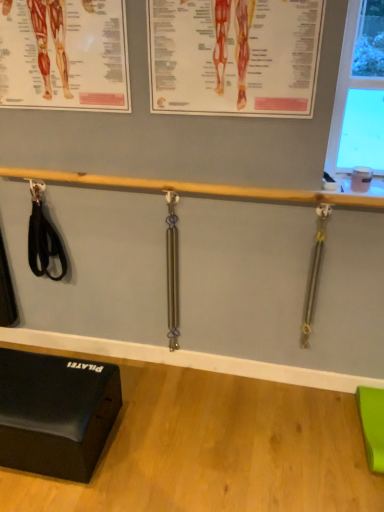
Question: Which direction should I rotate to look at orange paper poster at upper center, which is counted as the 2th poster page, starting from the left, — up or down?

Choices:
 (A) down
 (B) up

Answer: (B)

Question: From the image's perspective, is wooden bar at center located beneath polished metal weight at center, the 2th weight in the right-to-left sequence?

Choices:
 (A) yes
 (B) no

Answer: (B)

Question: From a real-world perspective, is wooden bar at center physically above polished metal weight at center, the 2th weight in the right-to-left sequence?

Choices:
 (A) no
 (B) yes

Answer: (B)

Question: Is wooden bar at center at the left side of polished metal weight at center, which appears as the 1th weight when viewed from the left?

Choices:
 (A) no
 (B) yes

Answer: (A)

Question: Is wooden bar at center aimed at polished metal weight at center, the 2th weight in the right-to-left sequence?

Choices:
 (A) no
 (B) yes

Answer: (A)

Question: Is wooden bar at center closer to camera compared to polished metal weight at center, the 2th weight in the right-to-left sequence?

Choices:
 (A) yes
 (B) no

Answer: (A)

Question: Does wooden bar at center have a larger size compared to polished metal weight at center, which appears as the 1th weight when viewed from the left?

Choices:
 (A) no
 (B) yes

Answer: (B)

Question: Is gold metallic weight at right, the first weight when ordered from right to left, positioned beyond the bounds of polished metal weight at center, which appears as the 1th weight when viewed from the left?

Choices:
 (A) no
 (B) yes

Answer: (B)

Question: Is gold metallic weight at right, acting as the 2th weight starting from the left, next to polished metal weight at center, which appears as the 1th weight when viewed from the left?

Choices:
 (A) no
 (B) yes

Answer: (A)

Question: Is gold metallic weight at right, acting as the 2th weight starting from the left, facing away from polished metal weight at center, which appears as the 1th weight when viewed from the left?

Choices:
 (A) no
 (B) yes

Answer: (A)

Question: From the image's perspective, is gold metallic weight at right, the first weight when ordered from right to left, located above polished metal weight at center, the 2th weight in the right-to-left sequence?

Choices:
 (A) yes
 (B) no

Answer: (A)

Question: Is gold metallic weight at right, acting as the 2th weight starting from the left, at the right side of polished metal weight at center, the 2th weight in the right-to-left sequence?

Choices:
 (A) yes
 (B) no

Answer: (A)

Question: Is there a large distance between matte paper poster at upper left, the first poster page in the left-to-right sequence, and wooden bar at center?

Choices:
 (A) no
 (B) yes

Answer: (A)